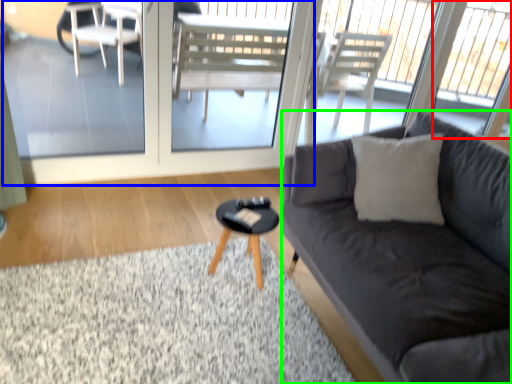
Question: Considering the real-world distances, which object is farthest from window (highlighted by a red box)? screen door (highlighted by a blue box) or studio couch (highlighted by a green box)?

Choices:
 (A) screen door
 (B) studio couch

Answer: (B)